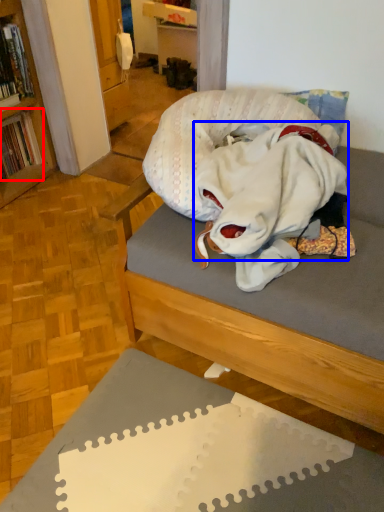
Question: Which point is closer to the camera, book (highlighted by a red box) or clothing (highlighted by a blue box)?

Choices:
 (A) book
 (B) clothing

Answer: (B)